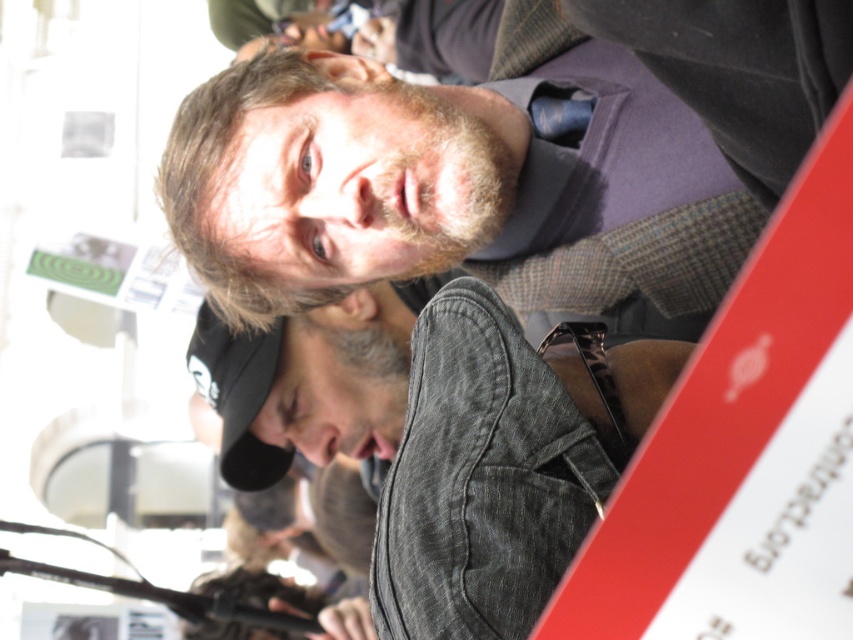
Question: Which point is closer to the camera taking this photo?

Choices:
 (A) (660, 97)
 (B) (413, 547)

Answer: (B)

Question: Can you confirm if matte gray jacket at center is wider than dark gray denim jacket at lower center?

Choices:
 (A) yes
 (B) no

Answer: (A)

Question: Is matte gray jacket at center bigger than dark gray denim jacket at lower center?

Choices:
 (A) no
 (B) yes

Answer: (B)

Question: Among these objects, which one is nearest to the camera?

Choices:
 (A) matte gray jacket at center
 (B) dark gray denim jacket at lower center

Answer: (A)

Question: Which of the following is the closest to the observer?

Choices:
 (A) dark gray denim jacket at lower center
 (B) matte gray jacket at center

Answer: (B)

Question: Is matte gray jacket at center smaller than dark gray denim jacket at lower center?

Choices:
 (A) yes
 (B) no

Answer: (B)